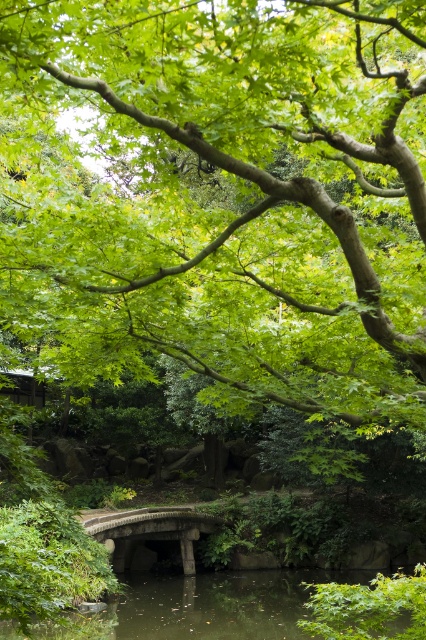
Question: Is green liquid water at center thinner than stone bridge at center?

Choices:
 (A) yes
 (B) no

Answer: (B)

Question: Is the position of green liquid water at center more distant than that of stone bridge at center?

Choices:
 (A) yes
 (B) no

Answer: (B)

Question: Is green liquid water at center positioned at the back of stone bridge at center?

Choices:
 (A) no
 (B) yes

Answer: (A)

Question: Which of the following is the farthest from the observer?

Choices:
 (A) stone bridge at center
 (B) green liquid water at center

Answer: (A)